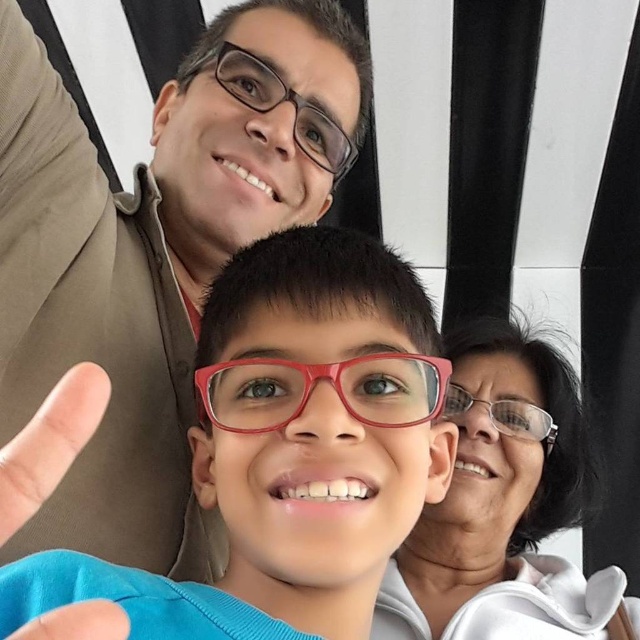
Looking at the selfie, you notice the matte blue shirt at center and the transparent plastic glasses at upper center. Which object appears larger in the image?

The matte blue shirt at center appears larger than the transparent plastic glasses at upper center because it is much taller as stated.

You are taking a photo of the matte brown shirt at upper left and the matte red glasses at center. Based on their positions, which object would appear closer to the camera in the final image?

The matte red glasses at center would appear closer to the camera because they are positioned in front of the matte brown shirt at upper left.

You are a photographer trying to adjust the camera focus. The matte brown shirt at upper left and the matte red glasses at center are in the frame. How far apart are these two items in inches?

The distance between the matte brown shirt at upper left and the matte red glasses at center is 12.00 inches.